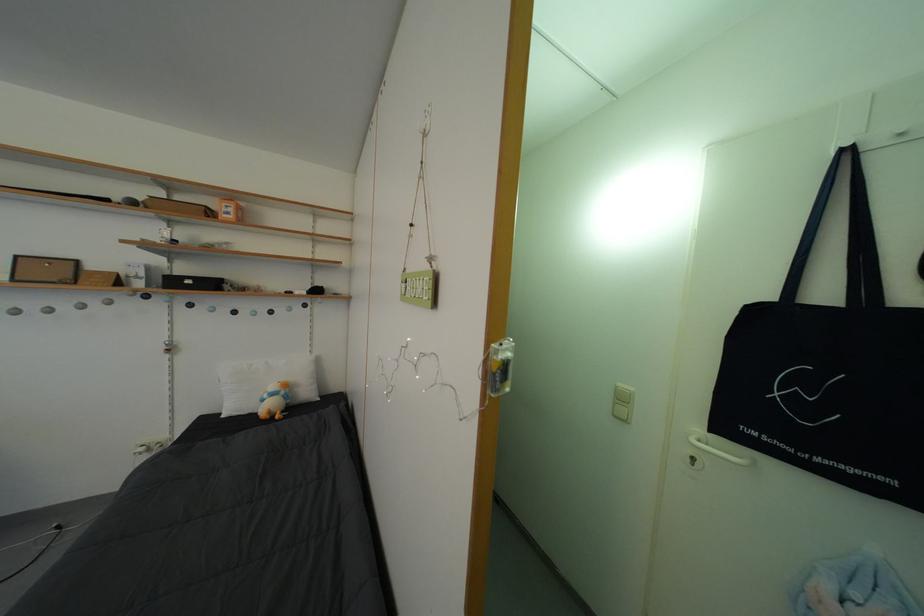
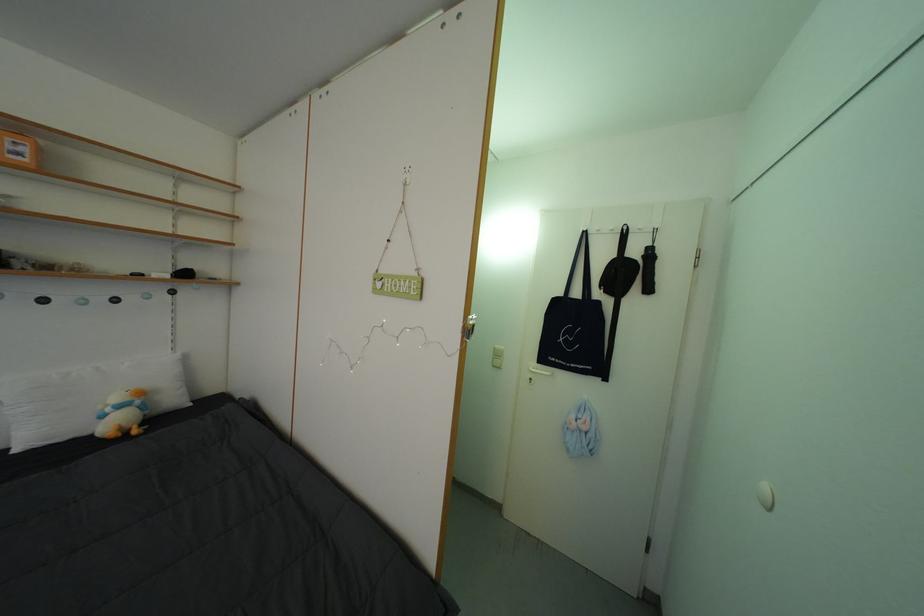
Locate, in the second image, the point that corresponds to point 625,392 in the first image.

(504, 354)